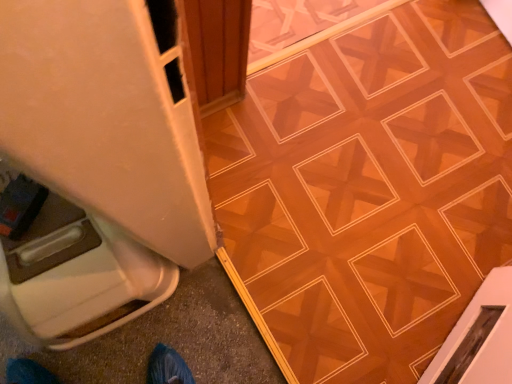
Find the location of `wooden parquet floor at center`. wooden parquet floor at center is located at coordinates (368, 190).

Looking at this image, measure the distance between point (256,142) and camera.

The distance of point (256,142) from camera is 4.42 feet.

Describe the element at coordinates (368, 190) in the screenshot. I see `wooden parquet floor at center` at that location.

What do you see at coordinates (98, 165) in the screenshot?
I see `white plastic container at lower left` at bounding box center [98, 165].

Measure the distance between white plastic container at lower left and camera.

A distance of 33.14 inches exists between white plastic container at lower left and camera.

Image resolution: width=512 pixels, height=384 pixels. In order to click on white plastic container at lower left in this screenshot , I will do `click(98, 165)`.

What are the coordinates of `wooden parquet floor at center` in the screenshot? It's located at (368, 190).

From the picture: Is wooden parquet floor at center at the left side of white plastic container at lower left?

No.

Is the position of wooden parquet floor at center less distant than that of white plastic container at lower left?

No, it is behind white plastic container at lower left.

Considering the positions of points (283, 366) and (106, 8), is point (283, 366) farther from camera compared to point (106, 8)?

Yes, point (283, 366) is farther from viewer.

From the image's perspective, which one is positioned higher, wooden parquet floor at center or white plastic container at lower left?

From the image's view, wooden parquet floor at center is above.

From a real-world perspective, is wooden parquet floor at center physically above white plastic container at lower left?

Actually, wooden parquet floor at center is physically below white plastic container at lower left in the real world.

Which object is thinner, wooden parquet floor at center or white plastic container at lower left?

Thinner between the two is white plastic container at lower left.

Between wooden parquet floor at center and white plastic container at lower left, which one has more height?

With more height is white plastic container at lower left.

In terms of size, does wooden parquet floor at center appear bigger or smaller than white plastic container at lower left?

Clearly, wooden parquet floor at center is smaller in size than white plastic container at lower left.

Would you say wooden parquet floor at center is outside white plastic container at lower left?

Indeed, wooden parquet floor at center is completely outside white plastic container at lower left.

Based on the photo, is wooden parquet floor at center next to white plastic container at lower left?

No, wooden parquet floor at center is not beside white plastic container at lower left.

Is wooden parquet floor at center oriented towards white plastic container at lower left?

No, wooden parquet floor at center is not aimed at white plastic container at lower left.

What's the angular difference between wooden parquet floor at center and white plastic container at lower left's facing directions?

The angular difference between wooden parquet floor at center and white plastic container at lower left is 90.2 degrees.

Where is `ceramic tile behind the white plastic container at lower left`? The image size is (512, 384). ceramic tile behind the white plastic container at lower left is located at coordinates tap(368, 190).

Which is more to the right, white plastic container at lower left or wooden parquet floor at center?

wooden parquet floor at center.

Is white plastic container at lower left positioned behind wooden parquet floor at center?

No, the depth of white plastic container at lower left is less than that of wooden parquet floor at center.

Considering the positions of point (62, 271) and point (283, 243), is point (62, 271) closer or farther from the camera than point (283, 243)?

Point (62, 271) appears to be closer to the viewer than point (283, 243).

From the image's perspective, which one is positioned higher, white plastic container at lower left or wooden parquet floor at center?

From the image's view, wooden parquet floor at center is above.

From a real-world perspective, is white plastic container at lower left below wooden parquet floor at center?

Actually, white plastic container at lower left is physically above wooden parquet floor at center in the real world.

Which object is thinner, white plastic container at lower left or wooden parquet floor at center?

white plastic container at lower left.

Between white plastic container at lower left and wooden parquet floor at center, which one has more height?

white plastic container at lower left.

Considering the sizes of objects white plastic container at lower left and wooden parquet floor at center in the image provided, who is smaller, white plastic container at lower left or wooden parquet floor at center?

wooden parquet floor at center.

Based on the photo, could wooden parquet floor at center be considered to be inside white plastic container at lower left?

No, wooden parquet floor at center is not surrounded by white plastic container at lower left.

Would you say white plastic container at lower left is a long distance from wooden parquet floor at center?

No, white plastic container at lower left is in close proximity to wooden parquet floor at center.

Is white plastic container at lower left aimed at wooden parquet floor at center?

No, white plastic container at lower left is not aimed at wooden parquet floor at center.

The width and height of the screenshot is (512, 384). Find the location of `appliance above the wooden parquet floor at center (from a real-world perspective)`. appliance above the wooden parquet floor at center (from a real-world perspective) is located at coordinates (98, 165).

Where is `ceramic tile that appears on the right of white plastic container at lower left`? The image size is (512, 384). ceramic tile that appears on the right of white plastic container at lower left is located at coordinates (368, 190).

At what (x,y) coordinates should I click in order to perform the action: click on ceramic tile behind the white plastic container at lower left. Please return your answer as a coordinate pair (x, y). Looking at the image, I should click on (368, 190).